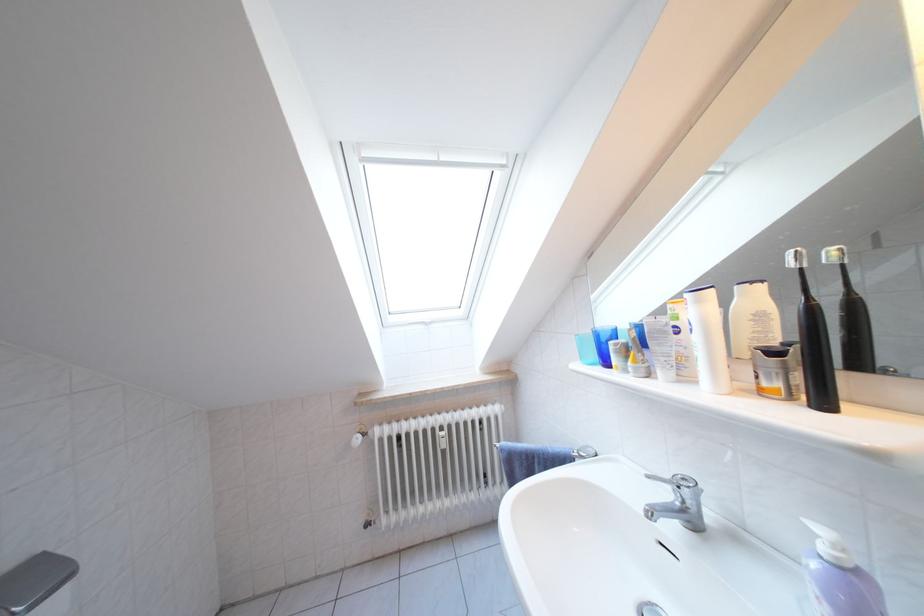
Find the location of a particular element. The width and height of the screenshot is (924, 616). silver faucet handle is located at coordinates (677, 503).